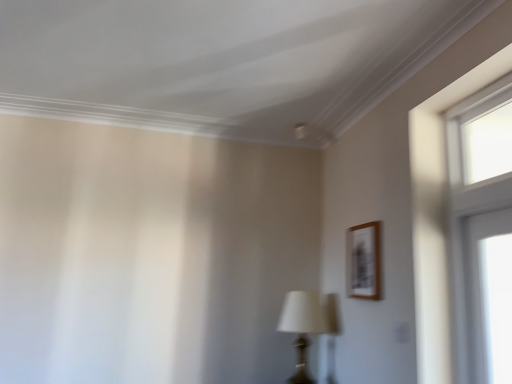
Question: Is wooden frame at upper right thinner than matte black table lamp at center?

Choices:
 (A) yes
 (B) no

Answer: (A)

Question: Is wooden frame at upper right not near matte black table lamp at center?

Choices:
 (A) yes
 (B) no

Answer: (B)

Question: Could you tell me if wooden frame at upper right is facing matte black table lamp at center?

Choices:
 (A) yes
 (B) no

Answer: (B)

Question: Is wooden frame at upper right looking in the opposite direction of matte black table lamp at center?

Choices:
 (A) no
 (B) yes

Answer: (A)

Question: From a real-world perspective, is wooden frame at upper right located higher than matte black table lamp at center?

Choices:
 (A) no
 (B) yes

Answer: (B)

Question: Is wooden frame at upper right positioned before matte black table lamp at center?

Choices:
 (A) yes
 (B) no

Answer: (A)

Question: From a real-world perspective, is matte black table lamp at center physically below clear glass window at upper right?

Choices:
 (A) yes
 (B) no

Answer: (A)

Question: Is matte black table lamp at center outside of clear glass window at upper right?

Choices:
 (A) no
 (B) yes

Answer: (B)

Question: From the image's perspective, is matte black table lamp at center on top of clear glass window at upper right?

Choices:
 (A) yes
 (B) no

Answer: (B)

Question: Can you confirm if matte black table lamp at center is wider than clear glass window at upper right?

Choices:
 (A) yes
 (B) no

Answer: (A)

Question: Is matte black table lamp at center further to the viewer compared to clear glass window at upper right?

Choices:
 (A) yes
 (B) no

Answer: (A)

Question: From a real-world perspective, is matte black table lamp at center over clear glass window at upper right?

Choices:
 (A) yes
 (B) no

Answer: (B)

Question: From a real-world perspective, is clear glass window at upper right on wooden frame at upper right?

Choices:
 (A) yes
 (B) no

Answer: (A)